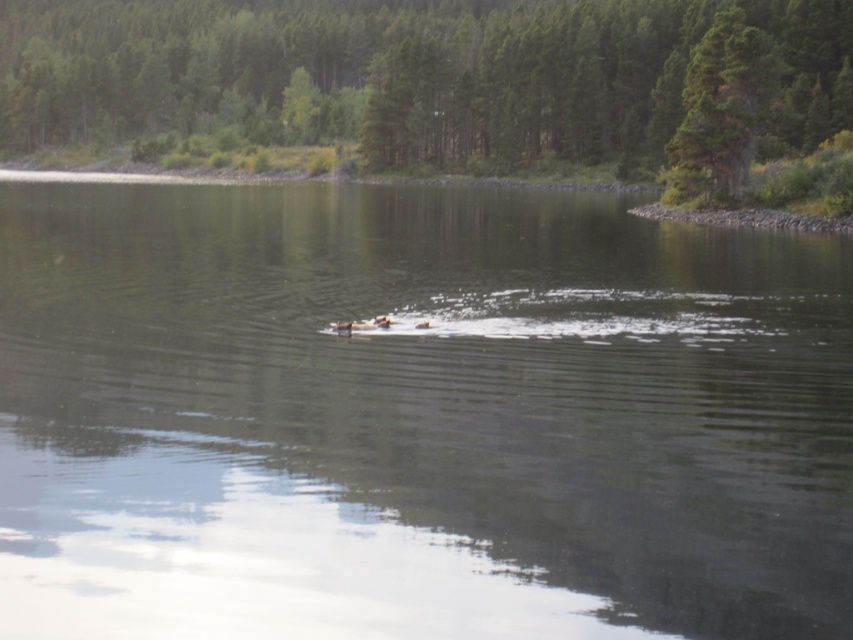
You are standing on the lakeshore and want to take a photo of the clear water at center and the green textured tree at upper center. Which object should you point your camera towards first if you want to capture both in one shot?

You should point your camera towards the green textured tree at upper center first because it is located to the left of the clear water at center, allowing both to be captured in one shot.

You are a photographer trying to capture the clear water at center and the green textured tree at upper center in a single shot. Based on their positions, which object would appear closer to the camera in the photo?

The clear water at center appears closer to the camera than the green textured tree at upper center because it is shorter in the scene.

You are standing at the edge of the lake and want to locate two points marked in the scene. Which of the two points, point (120, 525) or point (276, 129), is closer to you?

Point (120, 525) is closer to the viewer than point (276, 129).